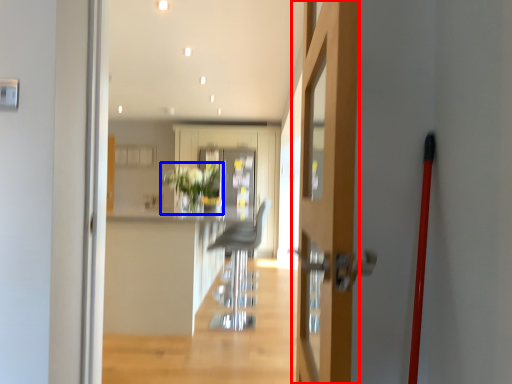
Question: Among these objects, which one is farthest to the camera, door (highlighted by a red box) or plant (highlighted by a blue box)?

Choices:
 (A) door
 (B) plant

Answer: (B)